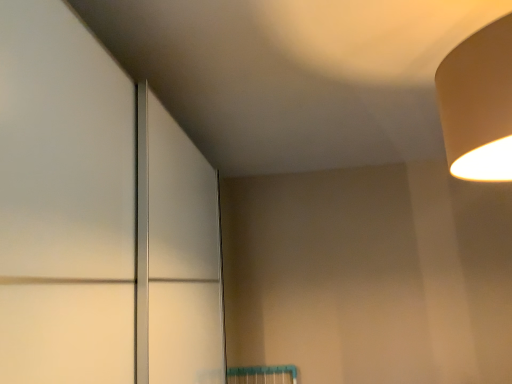
The width and height of the screenshot is (512, 384). What do you see at coordinates (64, 201) in the screenshot?
I see `matte white door at center` at bounding box center [64, 201].

Locate an element on the screen. The width and height of the screenshot is (512, 384). matte white door at center is located at coordinates (64, 201).

Describe the element at coordinates (478, 104) in the screenshot. I see `beige matte lampshade at upper right` at that location.

Image resolution: width=512 pixels, height=384 pixels. I want to click on beige matte lampshade at upper right, so click(478, 104).

This screenshot has height=384, width=512. I want to click on matte white door at center, so click(64, 201).

Is beige matte lampshade at upper right at the left side of matte white door at center?

No.

Considering the positions of objects beige matte lampshade at upper right and matte white door at center in the image provided, who is behind, beige matte lampshade at upper right or matte white door at center?

beige matte lampshade at upper right is further away from the camera.

Is point (455, 129) positioned before point (95, 241)?

No, (455, 129) is behind (95, 241).

From the image's perspective, is beige matte lampshade at upper right above matte white door at center?

Yes, from the image's perspective, beige matte lampshade at upper right is over matte white door at center.

From a real-world perspective, who is located higher, beige matte lampshade at upper right or matte white door at center?

beige matte lampshade at upper right.

Consider the image. In terms of width, does beige matte lampshade at upper right look wider or thinner when compared to matte white door at center?

beige matte lampshade at upper right is thinner than matte white door at center.

From their relative heights in the image, would you say beige matte lampshade at upper right is taller or shorter than matte white door at center?

Clearly, beige matte lampshade at upper right is shorter compared to matte white door at center.

Between beige matte lampshade at upper right and matte white door at center, which one has larger size?

matte white door at center.

Can matte white door at center be found inside beige matte lampshade at upper right?

No, matte white door at center is not a part of beige matte lampshade at upper right.

Is beige matte lampshade at upper right not near matte white door at center?

beige matte lampshade at upper right is near matte white door at center, not far away.

Does beige matte lampshade at upper right turn towards matte white door at center?

Yes, beige matte lampshade at upper right is turned towards matte white door at center.

Identify the location of lamp that appears above the matte white door at center (from the image's perspective). This screenshot has width=512, height=384. (478, 104).

Considering the positions of objects matte white door at center and beige matte lampshade at upper right in the image provided, who is more to the right, matte white door at center or beige matte lampshade at upper right?

Positioned to the right is beige matte lampshade at upper right.

Is matte white door at center in front of or behind beige matte lampshade at upper right in the image?

matte white door at center is positioned closer to the viewer than beige matte lampshade at upper right.

Considering the positions of points (46, 252) and (474, 43), is point (46, 252) farther from camera compared to point (474, 43)?

No, it is in front of (474, 43).

From the image's perspective, which one is positioned higher, matte white door at center or beige matte lampshade at upper right?

beige matte lampshade at upper right appears higher in the image.

From a real-world perspective, between matte white door at center and beige matte lampshade at upper right, who is vertically higher?

beige matte lampshade at upper right.

Considering the relative sizes of matte white door at center and beige matte lampshade at upper right in the image provided, is matte white door at center thinner than beige matte lampshade at upper right?

Incorrect, the width of matte white door at center is not less than that of beige matte lampshade at upper right.

Considering the sizes of matte white door at center and beige matte lampshade at upper right in the image, is matte white door at center taller or shorter than beige matte lampshade at upper right?

Considering their sizes, matte white door at center has more height than beige matte lampshade at upper right.

Does matte white door at center have a larger size compared to beige matte lampshade at upper right?

Yes, matte white door at center is bigger than beige matte lampshade at upper right.

Would you say matte white door at center contains beige matte lampshade at upper right?

No.

Is matte white door at center touching beige matte lampshade at upper right?

matte white door at center and beige matte lampshade at upper right are clearly separated.

From the picture: Is matte white door at center facing away from beige matte lampshade at upper right?

matte white door at center is not turned away from beige matte lampshade at upper right.

At what (x,y) coordinates should I click in order to perform the action: click on door below the beige matte lampshade at upper right (from a real-world perspective). Please return your answer as a coordinate pair (x, y). Looking at the image, I should click on (64, 201).

Where is `lamp on the right of matte white door at center`? lamp on the right of matte white door at center is located at coordinates (478, 104).

Locate an element on the screen. door in front of the beige matte lampshade at upper right is located at coordinates (64, 201).